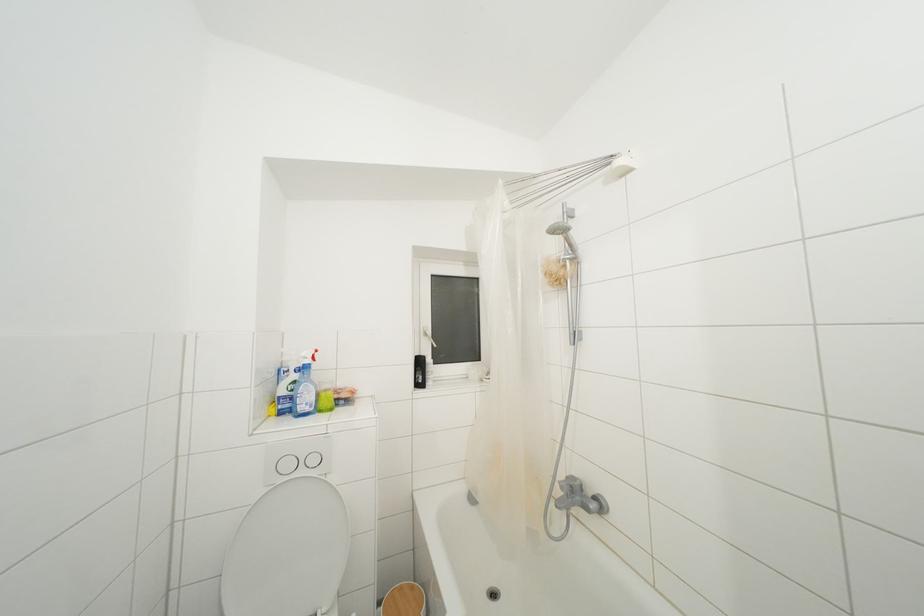
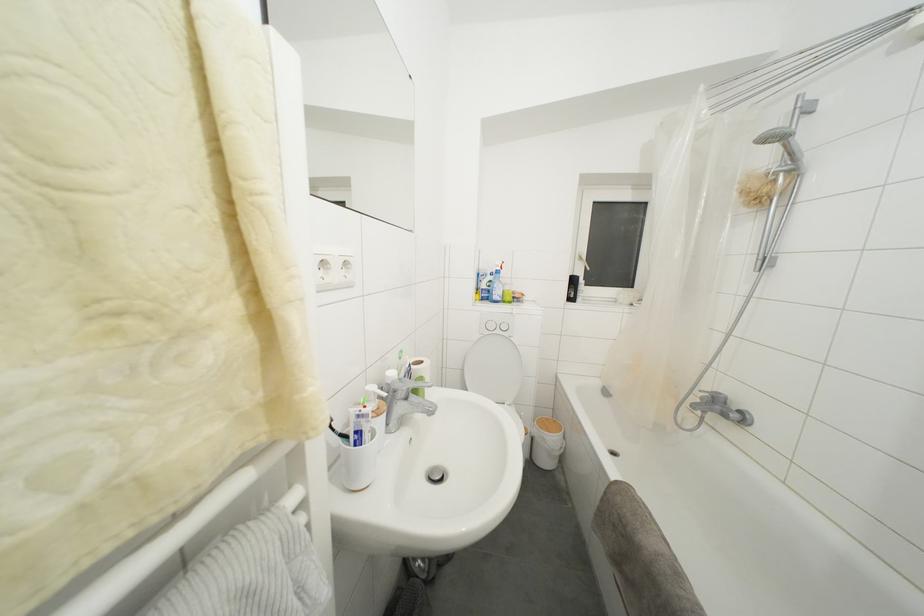
In the second image, find the point that corresponds to the point at 290,411 in the first image.

(490, 301)